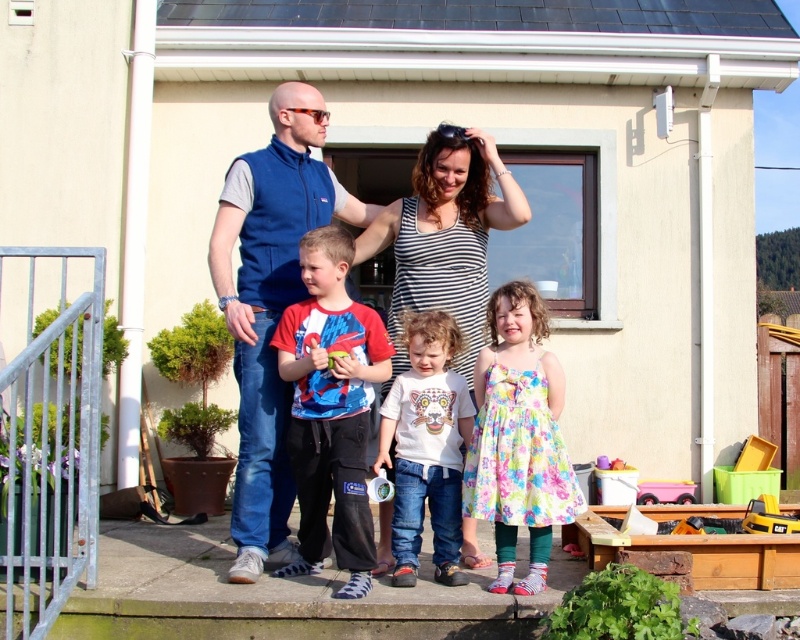
Where is `blue fleece vest at center`? blue fleece vest at center is located at coordinates (270, 305).

Between point (292, 182) and point (434, 176), which one is positioned in front?

Point (434, 176) is more forward.

At what (x,y) coordinates should I click in order to perform the action: click on blue fleece vest at center. Please return your answer as a coordinate pair (x, y). Looking at the image, I should click on (270, 305).

Is blue fleece vest at center taller than matte blue vest at upper left?

Indeed, blue fleece vest at center has a greater height compared to matte blue vest at upper left.

Can you confirm if blue fleece vest at center is positioned to the left of matte blue vest at upper left?

Indeed, blue fleece vest at center is positioned on the left side of matte blue vest at upper left.

Is point (270, 168) positioned behind point (474, 202)?

That is False.

Where is `blue fleece vest at center`? blue fleece vest at center is located at coordinates (270, 305).

Which is more to the right, matte blue vest at upper left or striped tank top at center?

Positioned to the right is striped tank top at center.

Consider the image. Who is shorter, matte blue vest at upper left or striped tank top at center?

matte blue vest at upper left is shorter.

Measure the distance between matte blue vest at upper left and camera.

A distance of 5.31 meters exists between matte blue vest at upper left and camera.

Where is `matte blue vest at upper left`? The width and height of the screenshot is (800, 640). matte blue vest at upper left is located at coordinates (448, 230).